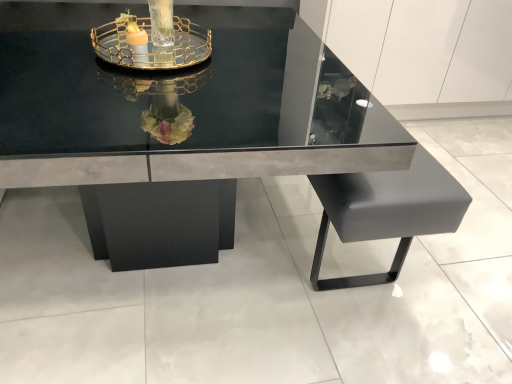
Question: From their relative heights in the image, would you say clear glass tray at upper center is taller or shorter than glossy black table at center?

Choices:
 (A) tall
 (B) short

Answer: (B)

Question: From a real-world perspective, is clear glass tray at upper center positioned above or below glossy black table at center?

Choices:
 (A) below
 (B) above

Answer: (B)

Question: From the image's perspective, is clear glass tray at upper center above or below glossy black table at center?

Choices:
 (A) below
 (B) above

Answer: (B)

Question: From the image's perspective, is glossy black table at center located above or below clear glass tray at upper center?

Choices:
 (A) above
 (B) below

Answer: (B)

Question: Does point (102, 226) appear closer or farther from the camera than point (132, 18)?

Choices:
 (A) closer
 (B) farther

Answer: (B)

Question: Is glossy black table at center wider or thinner than clear glass tray at upper center?

Choices:
 (A) thin
 (B) wide

Answer: (B)

Question: From a real-world perspective, is glossy black table at center physically located above or below clear glass tray at upper center?

Choices:
 (A) above
 (B) below

Answer: (B)